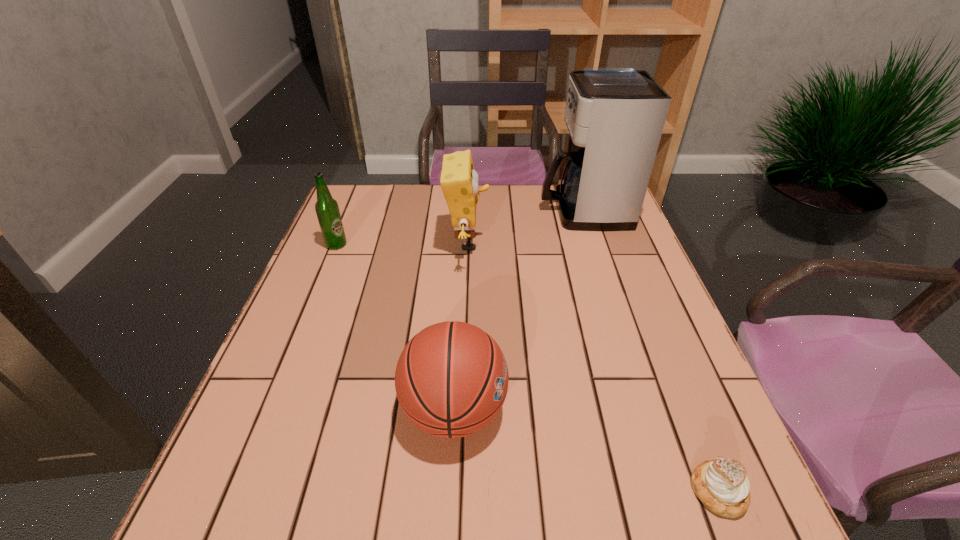
Locate an element on the screen. The height and width of the screenshot is (540, 960). coffee maker is located at coordinates (615, 117).

Where is `sponge`? This screenshot has height=540, width=960. sponge is located at coordinates (459, 181).

Find the location of a particular element. beer bottle is located at coordinates (327, 209).

Locate an element on the screen. Image resolution: width=960 pixels, height=540 pixels. basketball is located at coordinates (451, 380).

You are a GUI agent. You are given a task and a screenshot of the screen. Output one action in this format:
    pyautogui.click(x=<x>, y=<y>)
    Task: Click on the pastry
    This screenshot has height=540, width=960.
    Given the screenshot: What is the action you would take?
    pyautogui.click(x=722, y=485)

At what (x,y) coordinates should I click in order to perform the action: click on the nearest object. Please return your answer as a coordinate pair (x, y). This screenshot has width=960, height=540. Looking at the image, I should click on (722, 485).

I want to click on free location located 0.290m on the front panel of the tallest object, so 446,211.

The image size is (960, 540). Find the location of `vacant space situated on the front panel of the tallest object`. vacant space situated on the front panel of the tallest object is located at coordinates 515,211.

At what (x,y) coordinates should I click in order to perform the action: click on vacant space located 0.080m on the front panel of the tallest object. Please return your answer as a coordinate pair (x, y). Looking at the image, I should click on click(515, 211).

Identify the location of vacant space located on the face of the sponge. 520,242.